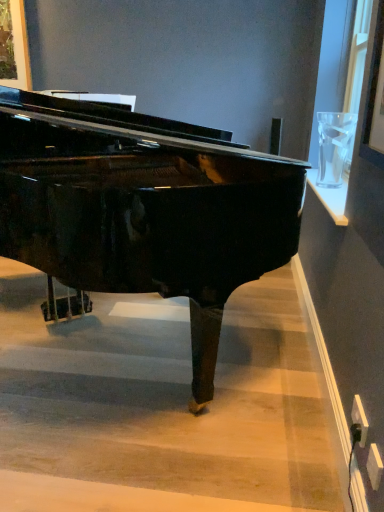
Question: Does glossy black piano at center have a smaller size compared to wooden stairwell at center?

Choices:
 (A) yes
 (B) no

Answer: (B)

Question: Considering the relative sizes of glossy black piano at center and wooden stairwell at center in the image provided, is glossy black piano at center bigger than wooden stairwell at center?

Choices:
 (A) yes
 (B) no

Answer: (A)

Question: Is glossy black piano at center taller than wooden stairwell at center?

Choices:
 (A) no
 (B) yes

Answer: (B)

Question: From a real-world perspective, is glossy black piano at center positioned over wooden stairwell at center based on gravity?

Choices:
 (A) yes
 (B) no

Answer: (A)

Question: Does glossy black piano at center appear on the right side of wooden stairwell at center?

Choices:
 (A) no
 (B) yes

Answer: (A)

Question: From a real-world perspective, is glossy black piano at center under wooden stairwell at center?

Choices:
 (A) yes
 (B) no

Answer: (B)

Question: Does wooden stairwell at center have a greater width compared to glossy black piano at center?

Choices:
 (A) no
 (B) yes

Answer: (B)

Question: Considering the relative sizes of wooden stairwell at center and glossy black piano at center in the image provided, is wooden stairwell at center thinner than glossy black piano at center?

Choices:
 (A) yes
 (B) no

Answer: (B)

Question: Could you tell me if wooden stairwell at center is facing glossy black piano at center?

Choices:
 (A) yes
 (B) no

Answer: (B)

Question: Is glossy black piano at center a part of wooden stairwell at center?

Choices:
 (A) no
 (B) yes

Answer: (A)

Question: Can you confirm if wooden stairwell at center is smaller than glossy black piano at center?

Choices:
 (A) no
 (B) yes

Answer: (B)

Question: Is the position of wooden stairwell at center less distant than that of glossy black piano at center?

Choices:
 (A) no
 (B) yes

Answer: (A)

Question: Considering their positions, is glossy black piano at center located in front of or behind wooden stairwell at center?

Choices:
 (A) behind
 (B) front

Answer: (B)